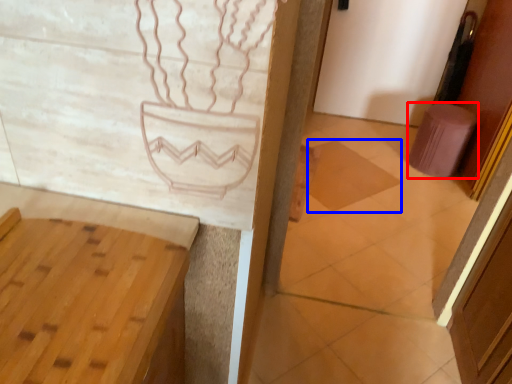
Question: Which point is closer to the camera, stool (highlighted by a red box) or tile (highlighted by a blue box)?

Choices:
 (A) stool
 (B) tile

Answer: (B)